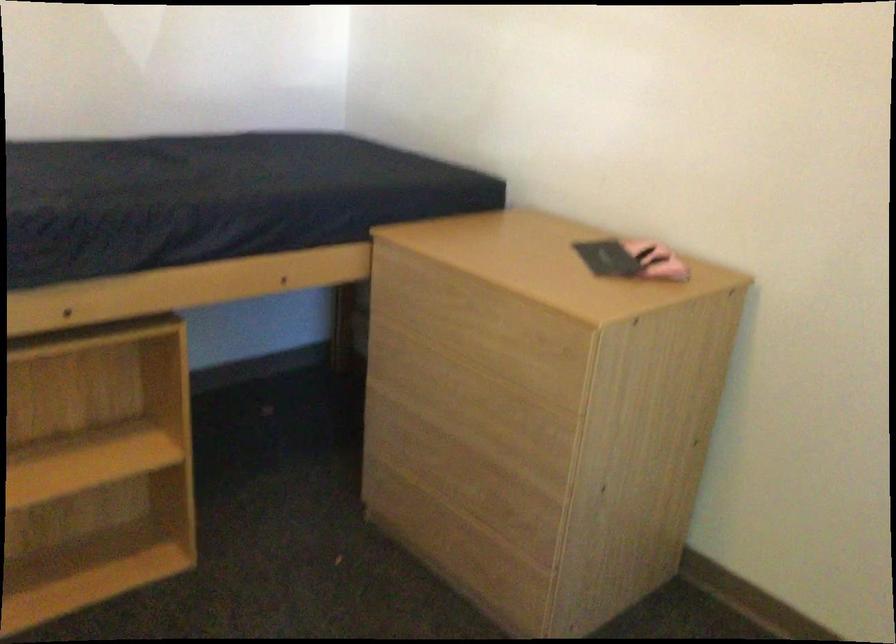
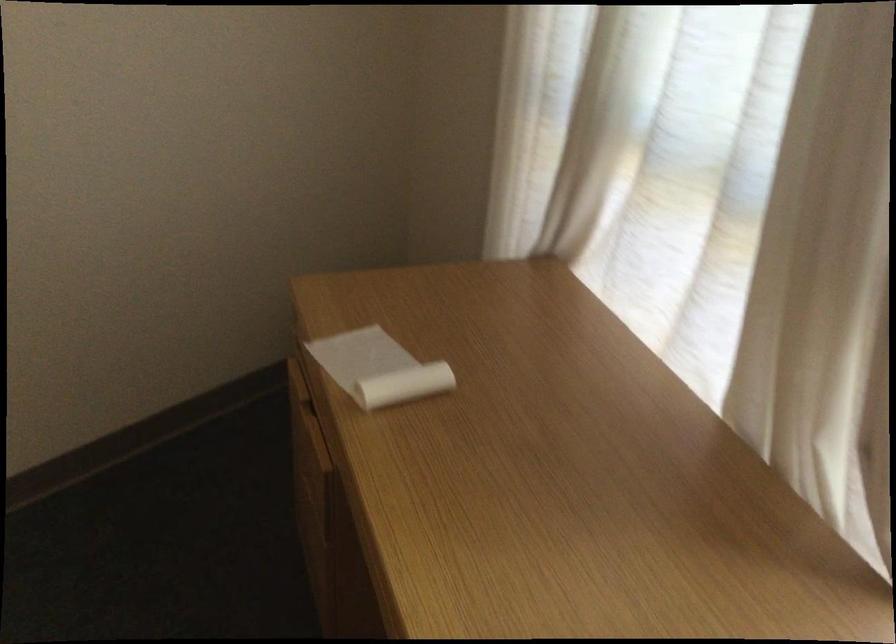
The images are taken continuously from a first-person perspective. In which direction is your viewpoint rotating?

The rotation direction of the camera is right-down.